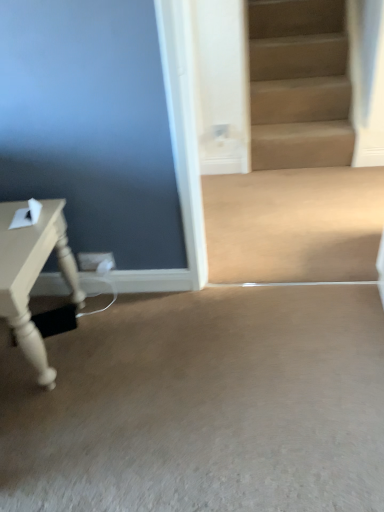
Describe the element at coordinates (203, 405) in the screenshot. I see `beige carpet at lower center, which is counted as the first concrete, starting from the bottom` at that location.

This screenshot has width=384, height=512. In order to click on matte white table at left in this screenshot , I will do `click(33, 275)`.

In order to click on beige smooth concrete at center, acting as the 1th concrete starting from the back in this screenshot , I will do coord(294,225).

Is beige smooth concrete at center, arranged as the 2th concrete when viewed from the front, a part of beige carpet at lower center, the 2th concrete when ordered from top to bottom?

No, beige smooth concrete at center, arranged as the 2th concrete when viewed from the front, is located outside of beige carpet at lower center, the 2th concrete when ordered from top to bottom.

Looking at their sizes, would you say beige carpet at lower center, which is counted as the first concrete, starting from the bottom, is wider or thinner than beige smooth concrete at center, acting as the 1th concrete starting from the back?

beige carpet at lower center, which is counted as the first concrete, starting from the bottom, is wider than beige smooth concrete at center, acting as the 1th concrete starting from the back.

Can you tell me how much beige carpet at lower center, which ranks as the 1th concrete in front-to-back order, and beige smooth concrete at center, arranged as the 2th concrete when viewed from the front, differ in facing direction?

The angular difference between beige carpet at lower center, which ranks as the 1th concrete in front-to-back order, and beige smooth concrete at center, arranged as the 2th concrete when viewed from the front, is 90.2 degrees.

Is matte white table at left at the right side of beige carpet at lower center, which ranks as the 1th concrete in front-to-back order?

Incorrect, matte white table at left is not on the right side of beige carpet at lower center, which ranks as the 1th concrete in front-to-back order.

In the scene shown: From a real-world perspective, who is located higher, matte white table at left or beige carpet at lower center, which is counted as the first concrete, starting from the bottom?

From a 3D spatial view, matte white table at left is above.

The height and width of the screenshot is (512, 384). What are the coordinates of `concrete located in front of the matte white table at left` in the screenshot? It's located at (203, 405).

Is matte white table at left touching beige carpet at lower center, which ranks as the 1th concrete in front-to-back order?

No, matte white table at left is not with beige carpet at lower center, which ranks as the 1th concrete in front-to-back order.

Is matte white table at left smaller than beige smooth concrete at center, arranged as the 2th concrete when viewed from the front?

No, matte white table at left is not smaller than beige smooth concrete at center, arranged as the 2th concrete when viewed from the front.

Could you measure the distance between matte white table at left and beige smooth concrete at center, the second concrete in the bottom-to-top sequence?

matte white table at left and beige smooth concrete at center, the second concrete in the bottom-to-top sequence, are 1.01 meters apart.

Find the location of a particular element. This screenshot has height=512, width=384. table that appears above the beige smooth concrete at center, acting as the 1th concrete starting from the back (from a real-world perspective) is located at coordinates (33, 275).

Who is taller, beige carpet at lower center, which ranks as the 1th concrete in front-to-back order, or matte white table at left?

matte white table at left.

Measure the distance from beige carpet at lower center, which is counted as the first concrete, starting from the bottom, to matte white table at left.

The distance of beige carpet at lower center, which is counted as the first concrete, starting from the bottom, from matte white table at left is 19.84 inches.

Looking at this image, from the image's perspective, is beige carpet at lower center, the 2th concrete when ordered from top to bottom, on top of matte white table at left?

No, from the image's perspective, beige carpet at lower center, the 2th concrete when ordered from top to bottom, is not above matte white table at left.

Could you tell me if beige carpet at lower center, which ranks as the 1th concrete in front-to-back order, is turned towards matte white table at left?

No, beige carpet at lower center, which ranks as the 1th concrete in front-to-back order, is not oriented towards matte white table at left.

Looking at this image, which point is more distant from viewer, (361,204) or (16,243)?

Point (361,204)

Based on their positions, is beige smooth concrete at center, arranged as the 2th concrete when viewed from the front, located to the left or right of matte white table at left?

In the image, beige smooth concrete at center, arranged as the 2th concrete when viewed from the front, appears on the right side of matte white table at left.

From the image's perspective, is beige smooth concrete at center, which appears as the 1th concrete when viewed from the top, located above or below matte white table at left?

beige smooth concrete at center, which appears as the 1th concrete when viewed from the top, is above matte white table at left.

From a real-world perspective, is beige smooth concrete at center, which appears as the 1th concrete when viewed from the top, positioned above or below beige carpet at lower center, the 2th concrete when ordered from top to bottom?

beige smooth concrete at center, which appears as the 1th concrete when viewed from the top, is above beige carpet at lower center, the 2th concrete when ordered from top to bottom.

Is beige smooth concrete at center, arranged as the 2th concrete when viewed from the front, aimed at beige carpet at lower center, marked as the 2th concrete in a back-to-front arrangement?

Yes, beige smooth concrete at center, arranged as the 2th concrete when viewed from the front, is turned towards beige carpet at lower center, marked as the 2th concrete in a back-to-front arrangement.

Is the depth of beige smooth concrete at center, arranged as the 2th concrete when viewed from the front, less than that of beige carpet at lower center, the 2th concrete when ordered from top to bottom?

No.

You are a GUI agent. You are given a task and a screenshot of the screen. Output one action in this format:
    pyautogui.click(x=<x>, y=<y>)
    Task: Click on the concrete on the right of the beige carpet at lower center, which ranks as the 1th concrete in front-to-back order
    
    Given the screenshot: What is the action you would take?
    pyautogui.click(x=294, y=225)

Find the location of a particular element. This screenshot has width=384, height=512. table that appears on the left of beige carpet at lower center, marked as the 2th concrete in a back-to-front arrangement is located at coordinates (33, 275).

When comparing their distances from beige smooth concrete at center, the second concrete in the bottom-to-top sequence, does matte white table at left or beige carpet at lower center, which is counted as the first concrete, starting from the bottom, seem further?

The object further to beige smooth concrete at center, the second concrete in the bottom-to-top sequence, is matte white table at left.

When comparing their distances from matte white table at left, does beige carpet at lower center, which is counted as the first concrete, starting from the bottom, or beige smooth concrete at center, arranged as the 2th concrete when viewed from the front, seem closer?

beige carpet at lower center, which is counted as the first concrete, starting from the bottom, is closer to matte white table at left.

Looking at the image, which one is located closer to beige smooth concrete at center, which appears as the 1th concrete when viewed from the top, beige carpet at lower center, the 2th concrete when ordered from top to bottom, or matte white table at left?

Among the two, beige carpet at lower center, the 2th concrete when ordered from top to bottom, is located nearer to beige smooth concrete at center, which appears as the 1th concrete when viewed from the top.

Looking at the image, which one is located further to matte white table at left, beige smooth concrete at center, arranged as the 2th concrete when viewed from the front, or beige carpet at lower center, the 2th concrete when ordered from top to bottom?

beige smooth concrete at center, arranged as the 2th concrete when viewed from the front, lies further to matte white table at left than the other object.

Looking at the image, which one is located closer to beige carpet at lower center, which is counted as the first concrete, starting from the bottom, matte white table at left or beige smooth concrete at center, arranged as the 2th concrete when viewed from the front?

matte white table at left is closer to beige carpet at lower center, which is counted as the first concrete, starting from the bottom.

Which object lies further to the anchor point beige carpet at lower center, which ranks as the 1th concrete in front-to-back order, beige smooth concrete at center, arranged as the 2th concrete when viewed from the front, or matte white table at left?

Based on the image, beige smooth concrete at center, arranged as the 2th concrete when viewed from the front, appears to be further to beige carpet at lower center, which ranks as the 1th concrete in front-to-back order.

Image resolution: width=384 pixels, height=512 pixels. In order to click on concrete between matte white table at left and beige smooth concrete at center, the second concrete in the bottom-to-top sequence, from left to right in this screenshot , I will do (203, 405).